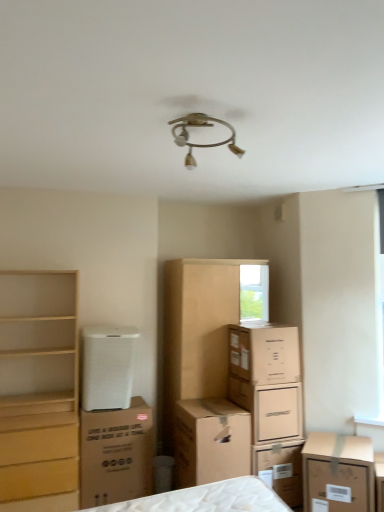
Question: Is brown cardboard box at center, which is the third cardboard box in left-to-right order, wider or thinner than brown cardboard box at center, positioned as the 4th cardboard box in right-to-left order?

Choices:
 (A) wide
 (B) thin

Answer: (B)

Question: Do you think brown cardboard box at center, which is the third cardboard box in left-to-right order, is within brown cardboard box at center, which is the second cardboard box from left to right, or outside of it?

Choices:
 (A) outside
 (B) inside

Answer: (A)

Question: Which is farther from the brown cardboard box at center, which is the third cardboard box in left-to-right order?

Choices:
 (A) brown cardboard box at lower right, which appears as the fifth cardboard box when viewed from the left
 (B) light wood chest of drawers at left
 (C) white cardboard box at center, which ranks as the second cardboard box in right-to-left order
 (D) brown cardboard box at center, which is the second cardboard box from left to right
 (E) brown cardboard box at lower left, the fifth cardboard box positioned from the right

Answer: (B)

Question: Considering the real-world distances, which object is farthest from the light wood chest of drawers at left?

Choices:
 (A) brown cardboard box at lower left, which is the 1th cardboard box in left-to-right order
 (B) brown cardboard dresser at center
 (C) white mesh air purifier at lower left
 (D) brown cardboard box at center, positioned as the 4th cardboard box in right-to-left order
 (E) white cardboard box at center, placed as the fourth cardboard box when sorted from left to right

Answer: (E)